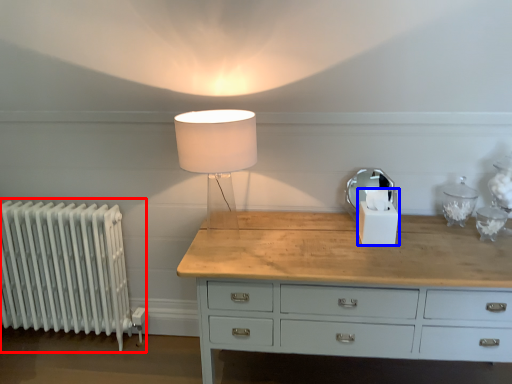
Question: Among these objects, which one is nearest to the camera, radiator (highlighted by a red box) or candle holder (highlighted by a blue box)?

Choices:
 (A) radiator
 (B) candle holder

Answer: (B)